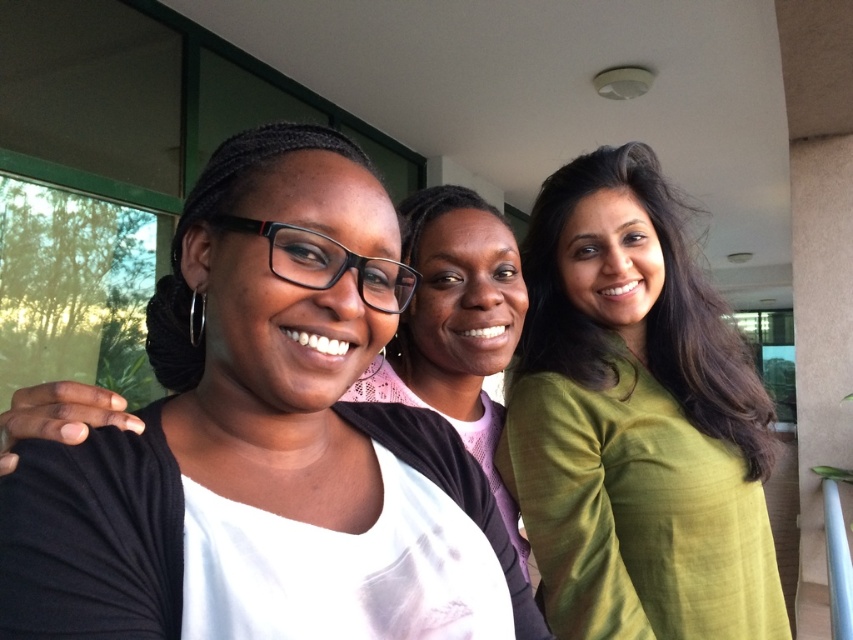
You are trying to decide which of the two shirts you can wear for a casual event. The event requires that the shirt must be wider than 12 inches. Given that the matte black shirt at center and the green silk shirt at right are the options, which one would you choose?

The green silk shirt at right is wider than the matte black shirt at center, so you should choose the green silk shirt at right since it meets the width requirement of 12 inches.

You are standing on the balcony and see a point at coordinates [257,426]. Which object is this point located on?

The point at coordinates [257,426] is located on the matte black shirt at center.

You are a photographer trying to capture a group photo of the matte black shirt at center and the green silk shirt at right. Since you want to ensure both subjects are in focus, you need to know which one is closer to the camera. Based on the scene description, which person is nearer to the camera?

The matte black shirt at center is smaller than the green silk shirt at right, which indicates it is farther away from the camera. Therefore, the green silk shirt at right is closer to the camera.